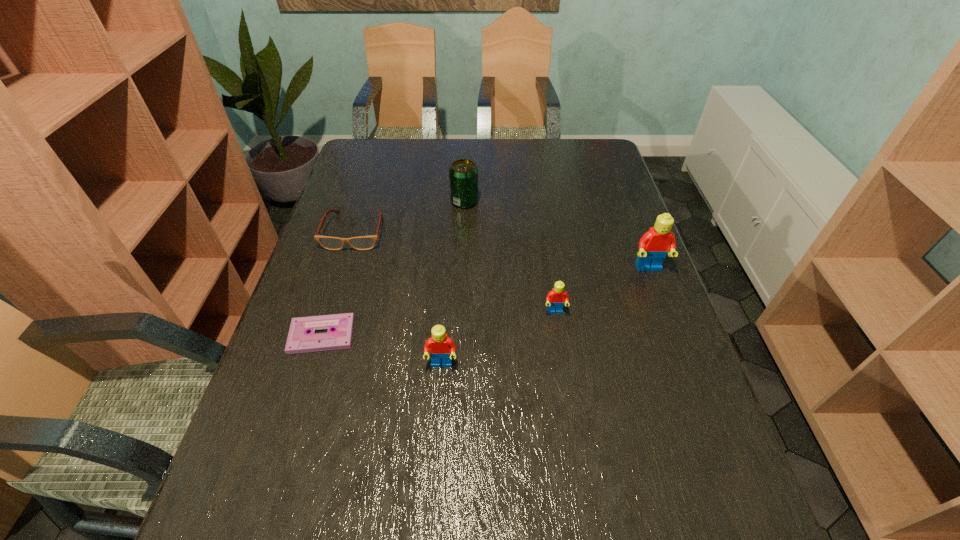
Find the location of a particular element. Image resolution: width=960 pixels, height=540 pixels. free space located 0.180m on the face of the nearest Lego is located at coordinates (435, 454).

Where is `free location located on the face of the fifth object from left to right`? free location located on the face of the fifth object from left to right is located at coordinates (581, 478).

Locate an element on the screen. free space located 0.400m on the face of the tallest Lego is located at coordinates (705, 417).

Where is `free spot located on the back of the farthest object`? Image resolution: width=960 pixels, height=540 pixels. free spot located on the back of the farthest object is located at coordinates [x=468, y=138].

Find the location of `vacant space situated on the back of the shortest object`. vacant space situated on the back of the shortest object is located at coordinates (350, 243).

Locate an element on the screen. The image size is (960, 540). vacant space located 0.210m on the front-facing side of the fifth tallest object is located at coordinates pos(331,310).

Where is `videotape at the left edge`? The image size is (960, 540). videotape at the left edge is located at coordinates (299, 340).

At what (x,y) coordinates should I click in order to perform the action: click on spectacles positioned at the left edge. Please return your answer as a coordinate pair (x, y). This screenshot has height=540, width=960. Looking at the image, I should click on [368, 242].

I want to click on object located at the right edge, so click(654, 245).

Locate an element on the screen. vacant space at the far edge of the desktop is located at coordinates (492, 146).